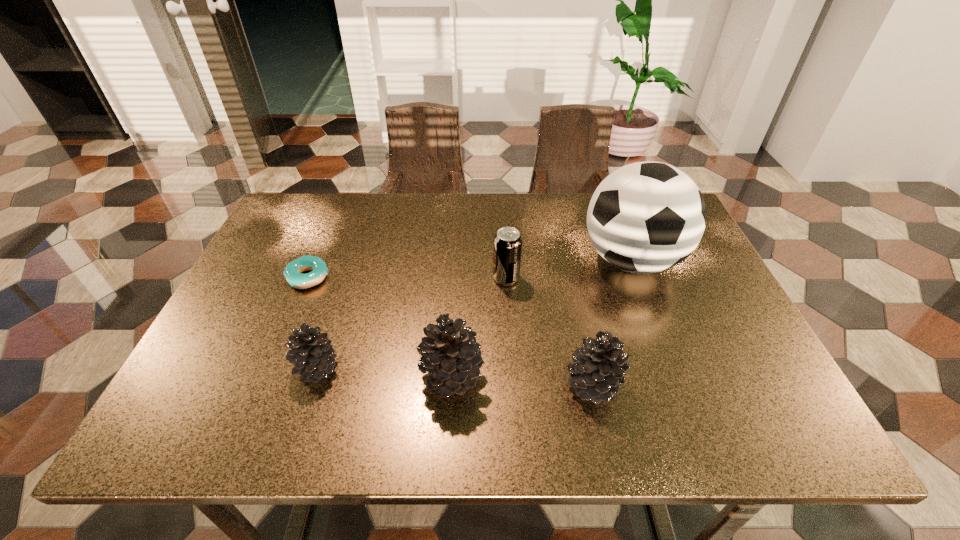
At what (x,y) coordinates should I click in order to perform the action: click on free location located 0.050m on the front of the tallest object. Please return your answer as a coordinate pair (x, y). The height and width of the screenshot is (540, 960). Looking at the image, I should click on (651, 312).

Locate an element on the screen. vacant area located on the front of the shortest object is located at coordinates (296, 307).

The width and height of the screenshot is (960, 540). What are the coordinates of `free space located 0.230m on the right of the soda can` in the screenshot? It's located at (608, 278).

Locate an element on the screen. object that is at the far edge is located at coordinates (646, 217).

Locate an element on the screen. The height and width of the screenshot is (540, 960). object that is at the left edge is located at coordinates (292, 272).

Locate an element on the screen. The image size is (960, 540). object present at the right edge is located at coordinates (646, 217).

You are a GUI agent. You are given a task and a screenshot of the screen. Output one action in this format:
    pyautogui.click(x=<x>, y=<y>)
    Task: Click on the object positioned at the far right corner
    
    Given the screenshot: What is the action you would take?
    pyautogui.click(x=646, y=217)

Locate an element on the screen. The height and width of the screenshot is (540, 960). free region at the far edge of the desktop is located at coordinates (451, 227).

This screenshot has width=960, height=540. I want to click on free space at the left edge, so click(x=296, y=254).

Locate an element on the screen. The height and width of the screenshot is (540, 960). vacant space at the right edge of the desktop is located at coordinates (701, 279).